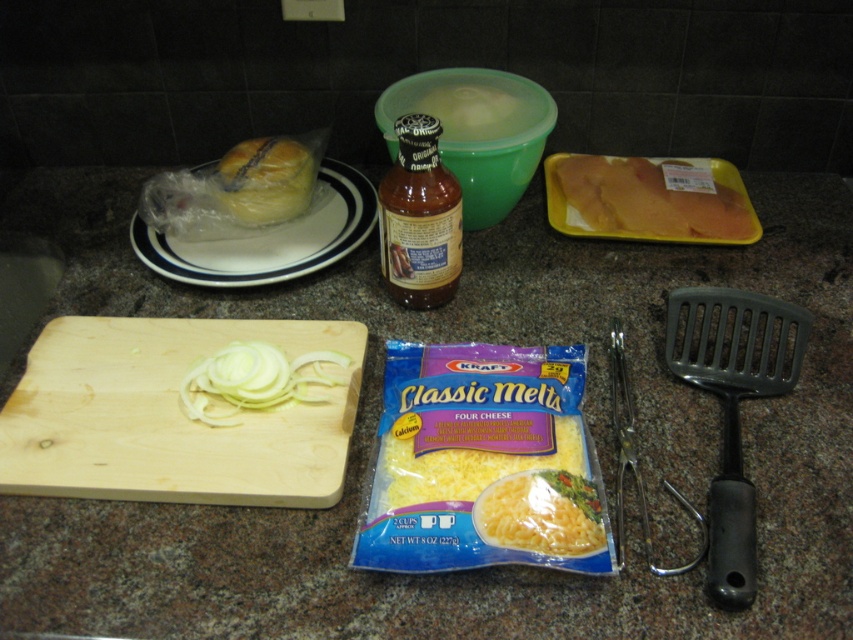
You are a chef preparing a dish and need to pour the contents of the brown glass bottle at center into the white matte bowl at center. Based on their positions, will the bottle be easy to access compared to the bowl?

The brown glass bottle at center is closer to the viewer than the white matte bowl at center, so it will be easier to access the bottle to pour into the bowl.

You are preparing a meal and need to stack the yellow plastic tray at center and the brown glass bottle at center on top of each other. Which one should you place at the bottom to ensure stability?

The yellow plastic tray at center has a lesser height compared to the brown glass bottle at center, so placing the taller brown glass bottle at center at the bottom would provide better stability.